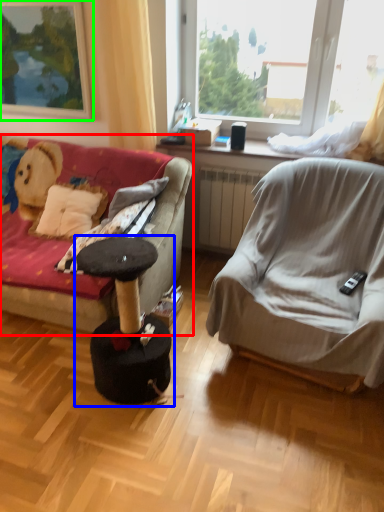
Question: Estimate the real-world distances between objects in this image. Which object is closer to studio couch (highlighted by a red box), music stool (highlighted by a blue box) or picture frame (highlighted by a green box)?

Choices:
 (A) music stool
 (B) picture frame

Answer: (A)